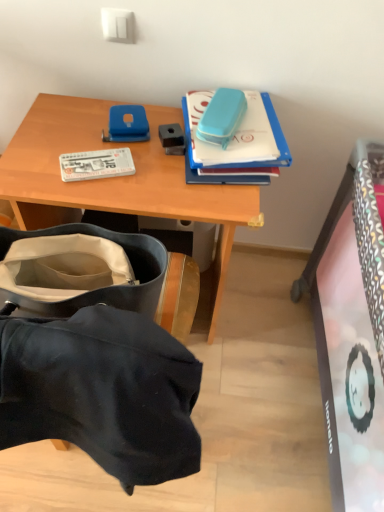
Question: Does white matte book at left, the 2th book viewed from the right, have a smaller size compared to blue matte case at upper right, arranged as the second book when viewed from the left?

Choices:
 (A) no
 (B) yes

Answer: (B)

Question: Considering the relative positions of white matte book at left, the 2th book viewed from the right, and blue matte case at upper right, arranged as the second book when viewed from the left, in the image provided, is white matte book at left, the 2th book viewed from the right, to the left of blue matte case at upper right, arranged as the second book when viewed from the left, from the viewer's perspective?

Choices:
 (A) no
 (B) yes

Answer: (B)

Question: Can you confirm if white matte book at left, the 1th book when ordered from left to right, is positioned to the right of blue matte case at upper right, the first book when ordered from right to left?

Choices:
 (A) no
 (B) yes

Answer: (A)

Question: Is white matte book at left, the 1th book when ordered from left to right, turned away from blue matte case at upper right, arranged as the second book when viewed from the left?

Choices:
 (A) yes
 (B) no

Answer: (B)

Question: Is the depth of white matte book at left, the 2th book viewed from the right, less than that of blue matte case at upper right, the first book when ordered from right to left?

Choices:
 (A) yes
 (B) no

Answer: (B)

Question: Considering the positions of wooden desk at upper center and white matte book at left, the 2th book viewed from the right, in the image, is wooden desk at upper center wider or thinner than white matte book at left, the 2th book viewed from the right,?

Choices:
 (A) wide
 (B) thin

Answer: (A)

Question: From a real-world perspective, is wooden desk at upper center positioned above or below white matte book at left, the 1th book when ordered from left to right?

Choices:
 (A) above
 (B) below

Answer: (B)

Question: Which is correct: wooden desk at upper center is inside white matte book at left, the 2th book viewed from the right, or outside of it?

Choices:
 (A) outside
 (B) inside

Answer: (A)

Question: Is wooden desk at upper center taller or shorter than white matte book at left, the 1th book when ordered from left to right?

Choices:
 (A) tall
 (B) short

Answer: (A)

Question: In the image, is white matte book at left, the 1th book when ordered from left to right, positioned in front of or behind blue matte case at upper right, arranged as the second book when viewed from the left?

Choices:
 (A) front
 (B) behind

Answer: (B)

Question: From a real-world perspective, is white matte book at left, the 1th book when ordered from left to right, above or below blue matte case at upper right, arranged as the second book when viewed from the left?

Choices:
 (A) above
 (B) below

Answer: (B)

Question: Do you think white matte book at left, the 1th book when ordered from left to right, is within blue matte case at upper right, arranged as the second book when viewed from the left, or outside of it?

Choices:
 (A) inside
 (B) outside

Answer: (B)

Question: From the image's perspective, is white matte book at left, the 1th book when ordered from left to right, located above or below blue matte case at upper right, the first book when ordered from right to left?

Choices:
 (A) below
 (B) above

Answer: (A)

Question: From their relative heights in the image, would you say wooden desk at upper center is taller or shorter than blue matte case at upper right, the first book when ordered from right to left?

Choices:
 (A) tall
 (B) short

Answer: (A)

Question: Is wooden desk at upper center to the left or to the right of blue matte case at upper right, arranged as the second book when viewed from the left, in the image?

Choices:
 (A) left
 (B) right

Answer: (A)